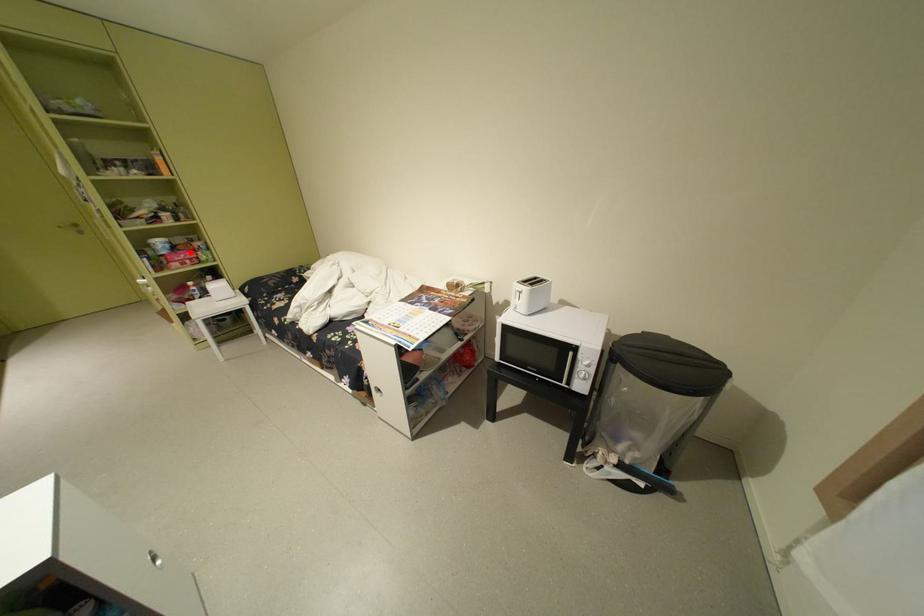
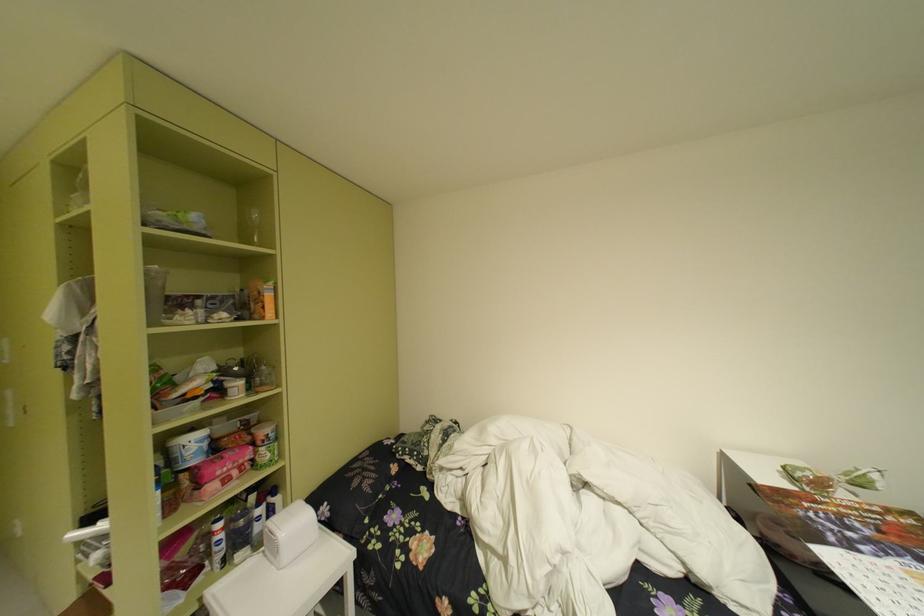
Find the pixel in the second image that matches the highlighted location in the first image.

(238, 455)